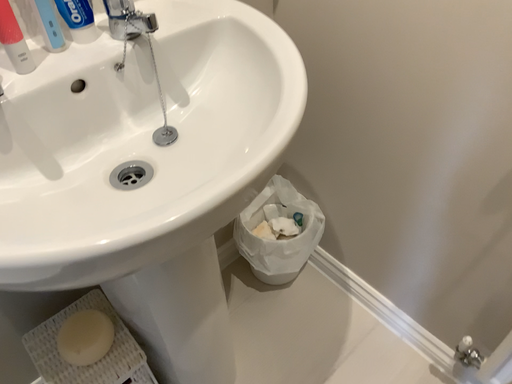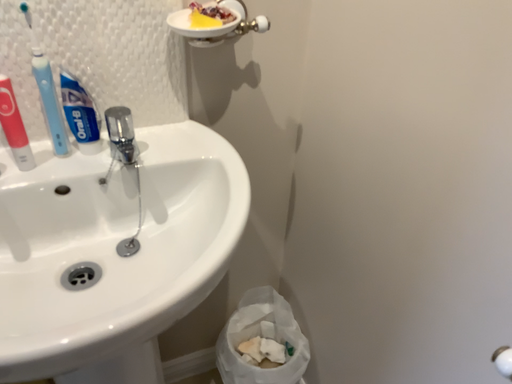
Question: How did the camera likely rotate when shooting the video?

Choices:
 (A) rotated right
 (B) rotated left

Answer: (B)